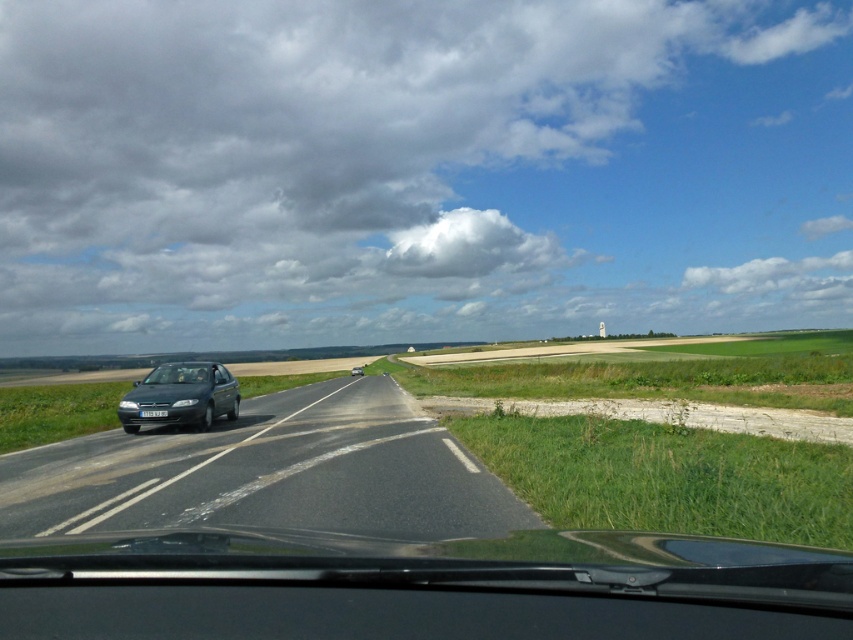
You are driving a truck that is 2 meters tall. You see a satin black car at left and a dark gray metallic car at center on the road. Can your truck pass under both vehicles without hitting them?

The satin black car at left is taller than the dark gray metallic car at center. Since your truck is 2 meters tall, you need to compare the height of both cars. However, the exact heights are not provided, so it is impossible to determine if the truck can pass under them without additional information.